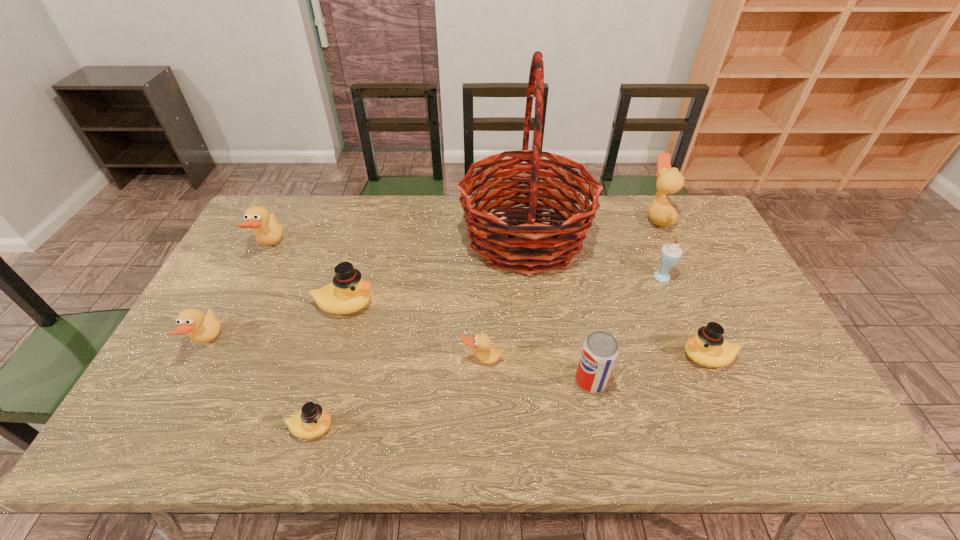
This screenshot has width=960, height=540. What are the coordinates of `the tallest object` in the screenshot? It's located at (535, 247).

Locate an element on the screen. The height and width of the screenshot is (540, 960). the tallest duck is located at coordinates (669, 180).

You are a GUI agent. You are given a task and a screenshot of the screen. Output one action in this format:
    pyautogui.click(x=<x>, y=<y>)
    Task: Click on the rightmost tan duck
    This screenshot has width=960, height=540.
    Given the screenshot: What is the action you would take?
    pyautogui.click(x=669, y=180)

I want to click on white milkshake, so click(671, 253).

The height and width of the screenshot is (540, 960). In order to click on the third smallest tan duck in this screenshot , I will do `click(264, 225)`.

At what (x,y) coordinates should I click in order to perform the action: click on soda. Please return your answer as a coordinate pair (x, y). Looking at the image, I should click on (600, 350).

Image resolution: width=960 pixels, height=540 pixels. In order to click on the fifth farthest object in this screenshot , I will do `click(348, 293)`.

Image resolution: width=960 pixels, height=540 pixels. I want to click on the biggest yellow duck, so click(x=348, y=293).

Locate an element on the screen. The image size is (960, 540). the second smallest tan duck is located at coordinates (200, 329).

Where is `the second nearest yellow duck`? This screenshot has height=540, width=960. the second nearest yellow duck is located at coordinates (708, 348).